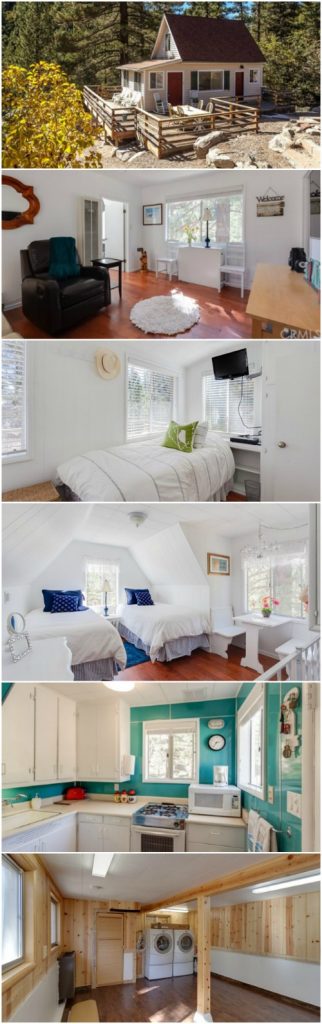
You are a GUI agent. You are given a task and a screenshot of the screen. Output one action in this format:
    pyautogui.click(x=<x>, y=<y>)
    Task: Click on the wall cabinets
    The width and height of the screenshot is (322, 1024).
    Given the screenshot: What is the action you would take?
    pyautogui.click(x=20, y=736), pyautogui.click(x=50, y=734), pyautogui.click(x=68, y=733), pyautogui.click(x=90, y=736), pyautogui.click(x=112, y=741)